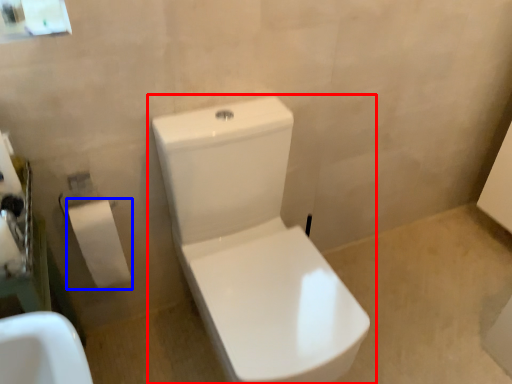
Question: Among these objects, which one is farthest to the camera, toilet (highlighted by a red box) or toiletry (highlighted by a blue box)?

Choices:
 (A) toilet
 (B) toiletry

Answer: (B)